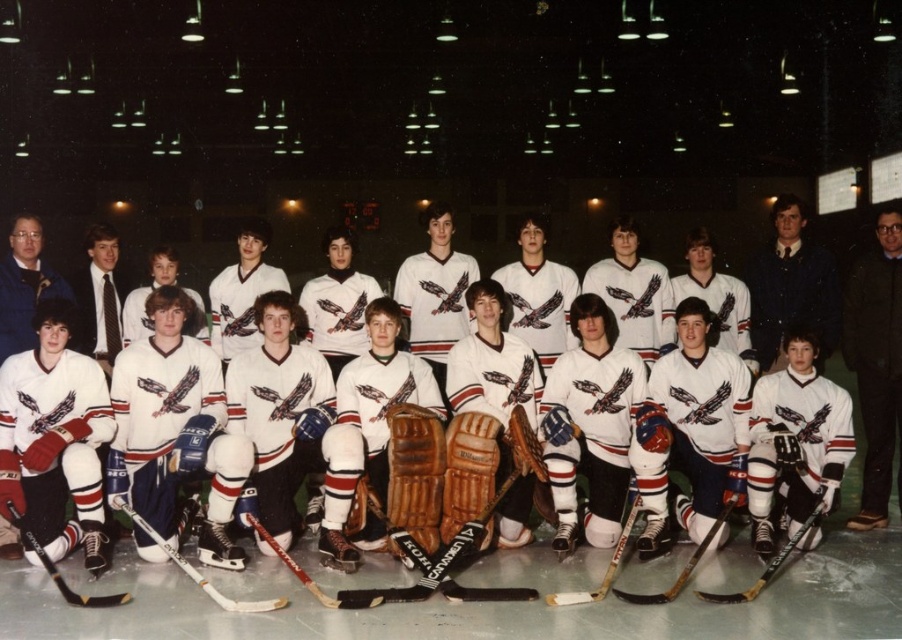
You are a photographer trying to capture a group photo of the hockey team. You notice the white matte hockey jerseys at center and the dark blue suit at center in the frame. Which object takes up more space in the image?

The dark blue suit at center occupies more space than the white matte hockey jerseys at center.

You are a hockey coach trying to select the right hockey stick for a demonstration. You have two options in the image, the black matte hockey stick at lower center and the black rubber hockey stick at lower left. Based on their appearance, which one is wider?

The black matte hockey stick at lower center is wider than the black rubber hockey stick at lower left according to the description.

You are a hockey coach trying to select the right hockey stick for a player who needs a larger one. Looking at the image, which of the two sticks should you choose between the black matte hockey stick at lower center and the black rubber hockey stick at lower left?

The black matte hockey stick at lower center has a larger size compared to the black rubber hockey stick at lower left, so you should choose the black matte hockey stick at lower center.